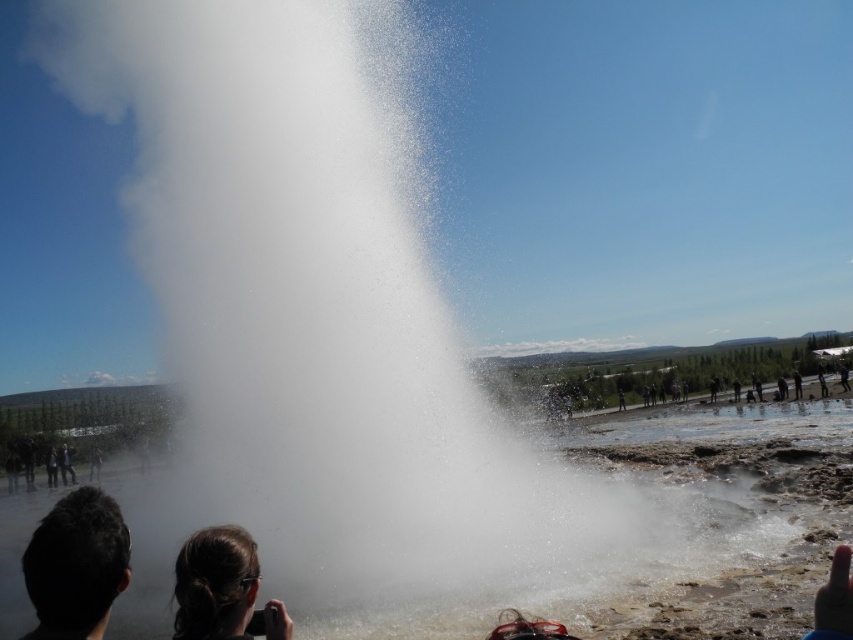
Who is positioned more to the right, white vapor at center or dark brown hair at lower left?

From the viewer's perspective, white vapor at center appears more on the right side.

Which is behind, point (679, 547) or point (41, 588)?

The point (679, 547) is behind.

This screenshot has height=640, width=853. What are the coordinates of `white vapor at center` in the screenshot? It's located at (635, 566).

Is dark brown hair at lower center above dark brown leather jacket at lower left?

Correct, dark brown hair at lower center is located above dark brown leather jacket at lower left.

Who is more forward, (193, 550) or (51, 467)?

Point (193, 550)

The width and height of the screenshot is (853, 640). I want to click on dark brown hair at lower center, so click(x=222, y=588).

Which is behind, point (142, 596) or point (223, 605)?

The point (142, 596) is more distant.

Based on the photo, does white vapor at center have a greater height compared to dark brown hair at lower center?

Indeed, white vapor at center has a greater height compared to dark brown hair at lower center.

Locate an element on the screen. The image size is (853, 640). white vapor at center is located at coordinates (635, 566).

Identify the location of white vapor at center. (635, 566).